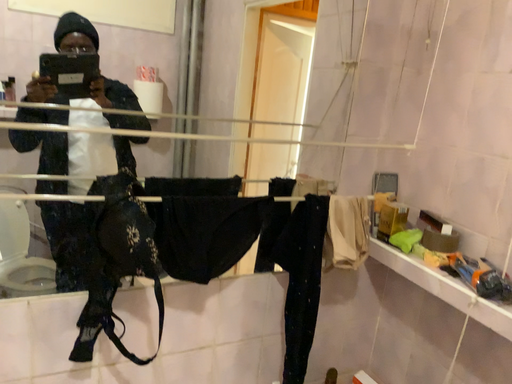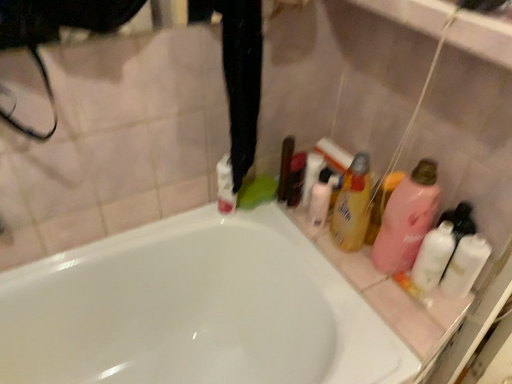
Question: How did the camera likely rotate when shooting the video?

Choices:
 (A) rotated upward
 (B) rotated downward

Answer: (B)